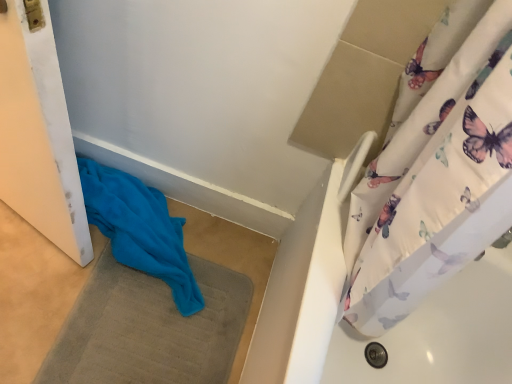
Question: Is blue soft towel at lower left looking in the opposite direction of blue fabric bath mat at lower left?

Choices:
 (A) no
 (B) yes

Answer: (A)

Question: From a real-world perspective, is blue soft towel at lower left beneath blue fabric bath mat at lower left?

Choices:
 (A) yes
 (B) no

Answer: (B)

Question: Considering the relative sizes of blue soft towel at lower left and blue fabric bath mat at lower left in the image provided, is blue soft towel at lower left thinner than blue fabric bath mat at lower left?

Choices:
 (A) yes
 (B) no

Answer: (A)

Question: Considering the relative positions of blue soft towel at lower left and blue fabric bath mat at lower left in the image provided, is blue soft towel at lower left to the left of blue fabric bath mat at lower left from the viewer's perspective?

Choices:
 (A) yes
 (B) no

Answer: (A)

Question: Can you confirm if blue soft towel at lower left is smaller than blue fabric bath mat at lower left?

Choices:
 (A) yes
 (B) no

Answer: (B)

Question: Is blue soft towel at lower left oriented towards blue fabric bath mat at lower left?

Choices:
 (A) yes
 (B) no

Answer: (B)

Question: Considering the relative positions of blue fabric bath mat at lower left and blue soft towel at lower left in the image provided, is blue fabric bath mat at lower left to the left of blue soft towel at lower left from the viewer's perspective?

Choices:
 (A) no
 (B) yes

Answer: (A)

Question: Considering the relative positions of blue fabric bath mat at lower left and blue soft towel at lower left in the image provided, is blue fabric bath mat at lower left in front of blue soft towel at lower left?

Choices:
 (A) no
 (B) yes

Answer: (B)

Question: Can you confirm if blue fabric bath mat at lower left is wider than blue soft towel at lower left?

Choices:
 (A) no
 (B) yes

Answer: (B)

Question: Does blue fabric bath mat at lower left turn towards blue soft towel at lower left?

Choices:
 (A) no
 (B) yes

Answer: (A)

Question: Can you confirm if blue fabric bath mat at lower left is bigger than blue soft towel at lower left?

Choices:
 (A) no
 (B) yes

Answer: (A)

Question: Is blue soft towel at lower left located within blue fabric bath mat at lower left?

Choices:
 (A) no
 (B) yes

Answer: (A)

Question: Visually, is blue fabric bath mat at lower left positioned to the left or to the right of blue soft towel at lower left?

Choices:
 (A) right
 (B) left

Answer: (A)